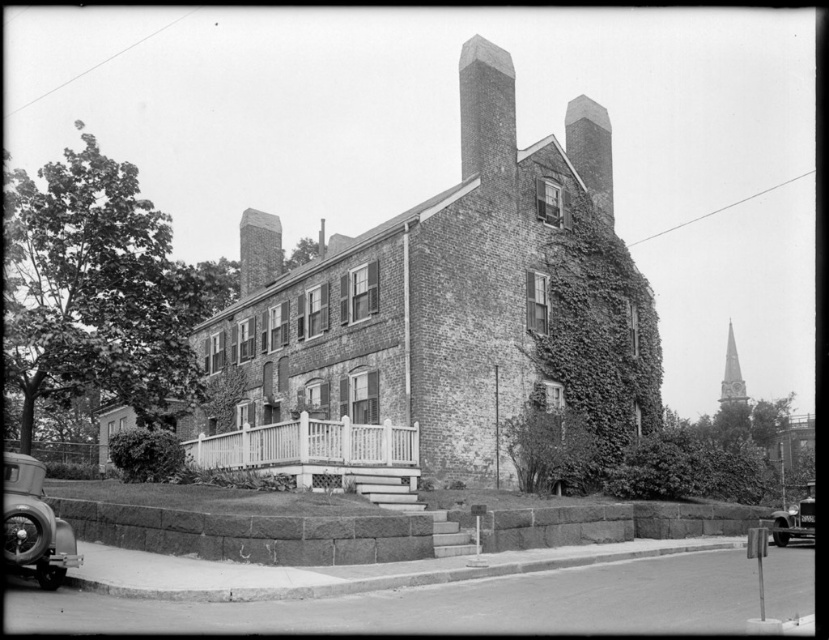
Question: Estimate the real-world distances between objects in this image. Which object is farther from the green ivy at center?

Choices:
 (A) smooth brick chimney at upper center
 (B) shiny chrome car at lower left
 (C) dark gray stone chimney at upper center

Answer: (B)

Question: Does shiny chrome car at lower left have a lesser width compared to smooth gray stone spire at upper right?

Choices:
 (A) no
 (B) yes

Answer: (B)

Question: Is green ivy at lower left positioned at the back of smooth stone chimney at upper center?

Choices:
 (A) yes
 (B) no

Answer: (B)

Question: Is dark gray stone chimney at upper center to the right of smooth gray stone spire at upper right from the viewer's perspective?

Choices:
 (A) no
 (B) yes

Answer: (A)

Question: Considering the real-world distances, which object is closest to the green ivy at lower left?

Choices:
 (A) smooth gray stone spire at upper right
 (B) smooth brick chimney at upper center

Answer: (B)

Question: Which of the following is the farthest from the observer?

Choices:
 (A) smooth stone chimney at upper center
 (B) dark gray stone chimney at upper center
 (C) green ivy at lower left
 (D) green ivy at center

Answer: (B)